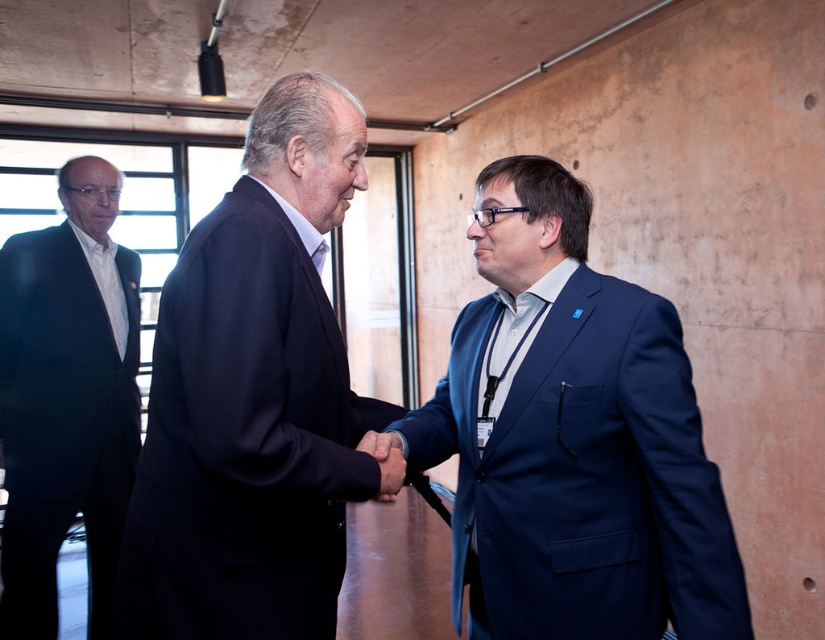
Question: Can you confirm if blue fabric suit at center is positioned to the right of black suit at left?

Choices:
 (A) no
 (B) yes

Answer: (B)

Question: Estimate the real-world distances between objects in this image. Which object is farther from the blue fabric suit at center?

Choices:
 (A) black suit at left
 (B) dark blue suit at center

Answer: (A)

Question: Can you confirm if blue fabric suit at center is positioned to the right of dark blue suit at center?

Choices:
 (A) yes
 (B) no

Answer: (A)

Question: Which point is closer to the camera?

Choices:
 (A) (138, 332)
 (B) (547, 513)
 (C) (252, 360)

Answer: (C)

Question: Which object is farther from the camera taking this photo?

Choices:
 (A) blue fabric suit at center
 (B) black suit at left

Answer: (B)

Question: From the image, what is the correct spatial relationship of blue fabric suit at center in relation to dark blue suit at center?

Choices:
 (A) right
 (B) left

Answer: (A)